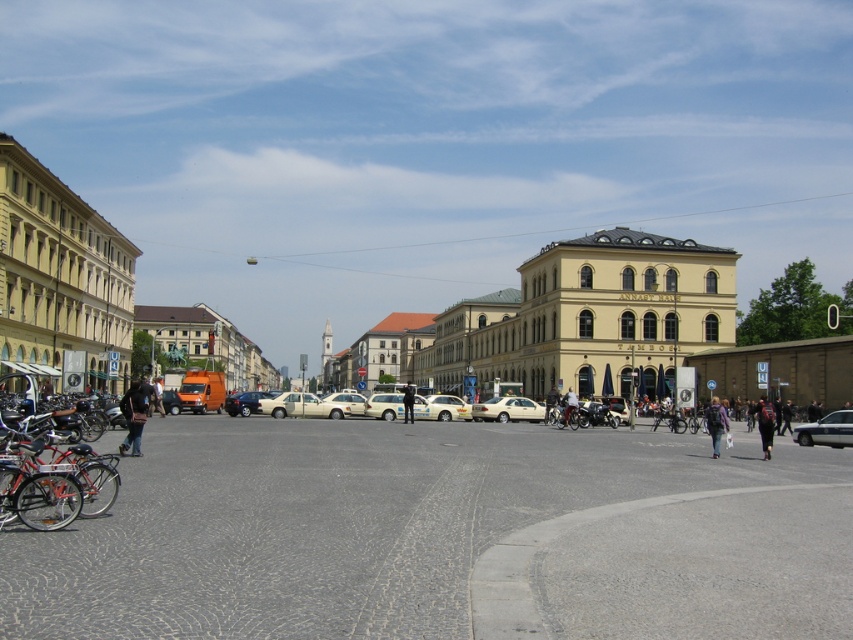
You are a pedestrian trying to cross the street from the red matte bicycle at lower left to the dark blue uniform at center. Is the path clear of any obstacles between them?

The red matte bicycle at lower left is positioned over the dark blue uniform at center, which means there is no space between them for you to walk through. The path is blocked by the bicycle.